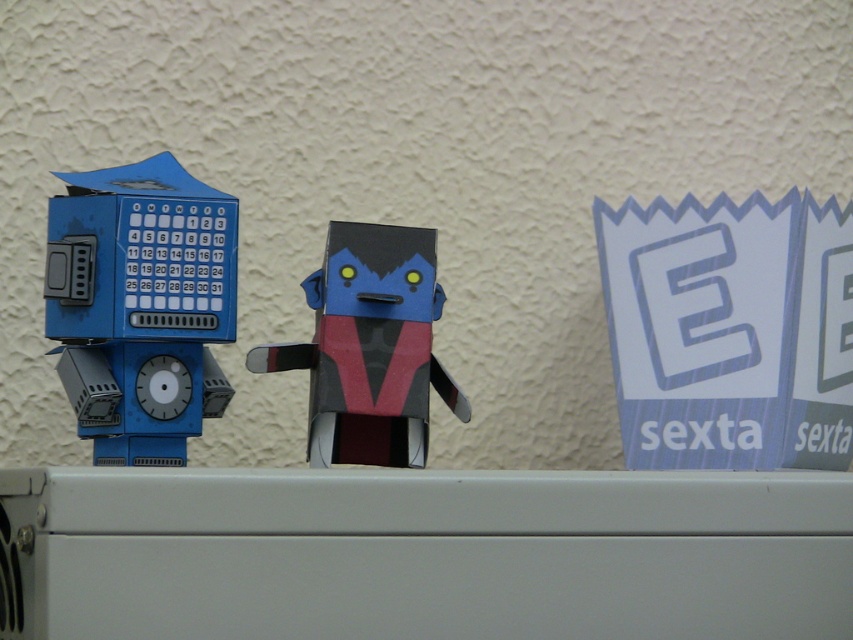
You are organizing a display for a school fair and need to arrange the matte blue robot at left and the matte black and red cardboard toy at center. If you want to place them side by side on a shelf, which one should be positioned at the back to avoid blocking the view of the smaller one?

The matte blue robot at left is much taller than the matte black and red cardboard toy at center, so to avoid blocking the view of the smaller one, the taller matte blue robot at left should be placed at the back.

You are a person standing in front of the image. You see a point at coordinates (140, 305). What object in the scene is located at that point?

The point at coordinates (140, 305) corresponds to the location of the matte blue robot at left.

You are organizing a display and need to place the matte blue robot at left and the matte black and red cardboard toy at center in a straight line from left to right. According to the scene, what order should they be arranged in?

The matte blue robot at left should be placed first on the left side, followed by the matte black and red cardboard toy at center to maintain the correct order as shown in the scene.